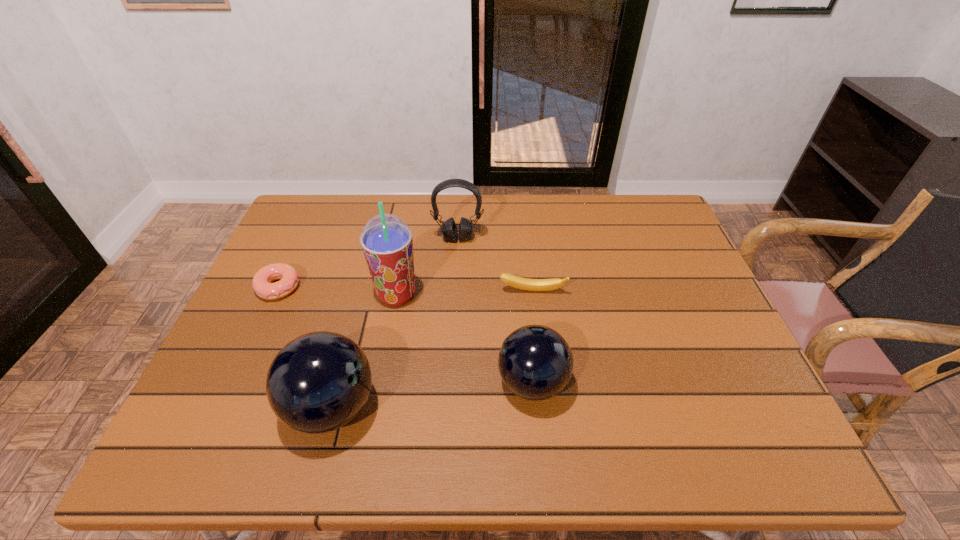
I want to click on vacant space at the near edge of the desktop, so click(372, 394).

This screenshot has width=960, height=540. What are the coordinates of `vacant space at the left edge` in the screenshot? It's located at (311, 271).

Locate an element on the screen. The height and width of the screenshot is (540, 960). free space at the right edge of the desktop is located at coordinates (695, 361).

Identify the location of free space at the far right corner of the desktop. (644, 206).

At what (x,y) coordinates should I click in order to perform the action: click on vacant area that lies between the shorter bowling ball and the smoothie. Please return your answer as a coordinate pair (x, y). Looking at the image, I should click on (465, 339).

This screenshot has width=960, height=540. I want to click on vacant space that is in between the fourth object from left to right and the taller bowling ball, so click(x=395, y=322).

Where is `unoccupied position between the right bowling ball and the leftmost object`? Image resolution: width=960 pixels, height=540 pixels. unoccupied position between the right bowling ball and the leftmost object is located at coordinates (405, 335).

This screenshot has width=960, height=540. What are the coordinates of `vacant area between the tallest object and the taller bowling ball` in the screenshot? It's located at (365, 351).

At what (x,y) coordinates should I click in order to perform the action: click on empty space between the shortest object and the smoothie. Please return your answer as a coordinate pair (x, y). The width and height of the screenshot is (960, 540). Looking at the image, I should click on (338, 291).

I want to click on free space between the left bowling ball and the fourth tallest object, so click(432, 395).